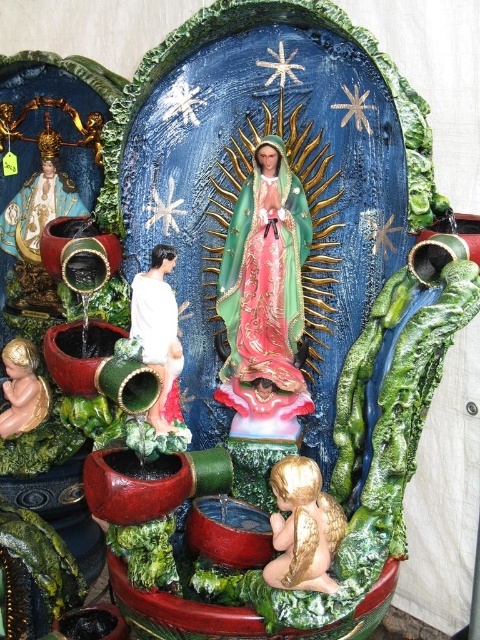
Question: Estimate the real-world distances between objects in this image. Which object is closer to the white matte statue at center-left?

Choices:
 (A) matte green fabric statue at center
 (B) gold painted wood baby at lower left

Answer: (A)

Question: Can you confirm if gold metallic angel at lower center is bigger than gold painted wood baby at lower left?

Choices:
 (A) no
 (B) yes

Answer: (B)

Question: Which point is farther from the camera taking this photo?

Choices:
 (A) (324, 554)
 (B) (22, 420)
 (C) (230, 314)

Answer: (B)

Question: Does matte green fabric statue at center appear under gold painted wood baby at lower left?

Choices:
 (A) no
 (B) yes

Answer: (A)

Question: Can you confirm if matte green fabric statue at center is positioned to the right of gold metallic angel at lower center?

Choices:
 (A) yes
 (B) no

Answer: (B)

Question: Which of these objects is positioned closest to the matte green fabric statue at center?

Choices:
 (A) white matte statue at center-left
 (B) gold metallic angel at lower center
 (C) gold painted wood baby at lower left

Answer: (A)